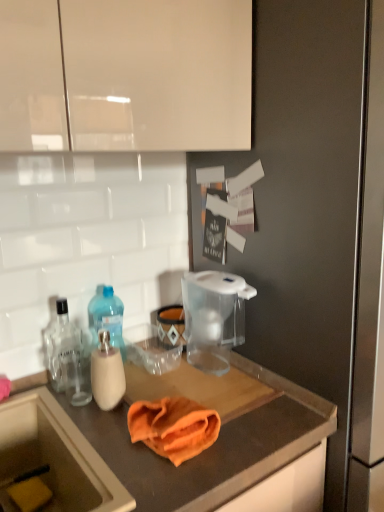
Where is `free location in front of orange microfiber cloth at center`? free location in front of orange microfiber cloth at center is located at coordinates (161, 482).